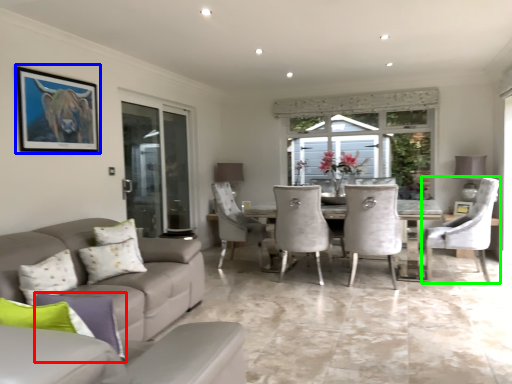
Question: Estimate the real-world distances between objects in this image. Which object is farther from pillow (highlighted by a red box), picture frame (highlighted by a blue box) or chair (highlighted by a green box)?

Choices:
 (A) picture frame
 (B) chair

Answer: (B)